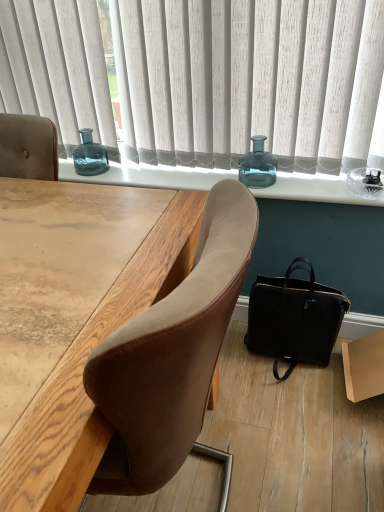
Where is `free spot to the right of transparent glass vase at upper center, the 2th bottle from the left`? free spot to the right of transparent glass vase at upper center, the 2th bottle from the left is located at coordinates (314, 181).